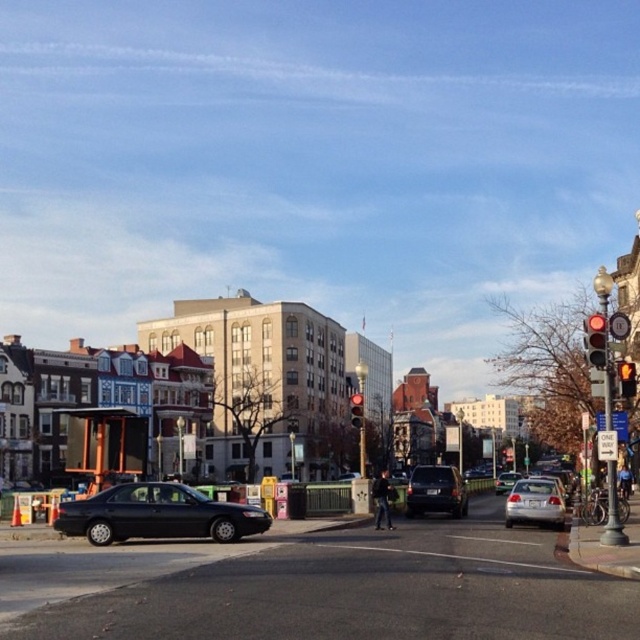
Question: Which point is closer to the camera taking this photo?

Choices:
 (A) (522, 484)
 (B) (355, 397)

Answer: (A)

Question: Which point is closer to the camera?

Choices:
 (A) red glass traffic light at upper right
 (B) shiny black sedan at lower left

Answer: (A)

Question: Considering the real-world distances, which object is closest to the red glass pedestrian signal at upper right?

Choices:
 (A) silver metallic sedan at center-right
 (B) matte black suv at center
 (C) shiny black sedan at lower left
 (D) red glass traffic light at center

Answer: (A)

Question: Is matte black suv at center to the right of red glass traffic light at center from the viewer's perspective?

Choices:
 (A) yes
 (B) no

Answer: (A)

Question: Does black matte sedan at lower left appear over red glass pedestrian signal at upper right?

Choices:
 (A) no
 (B) yes

Answer: (A)

Question: Is black matte sedan at lower left positioned behind matte black suv at center?

Choices:
 (A) no
 (B) yes

Answer: (A)